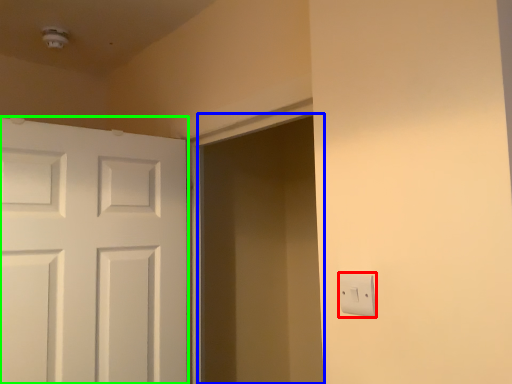
Question: Considering the real-world distances, which object is farthest from light switch (highlighted by a red box)? screen door (highlighted by a blue box) or door (highlighted by a green box)?

Choices:
 (A) screen door
 (B) door

Answer: (A)